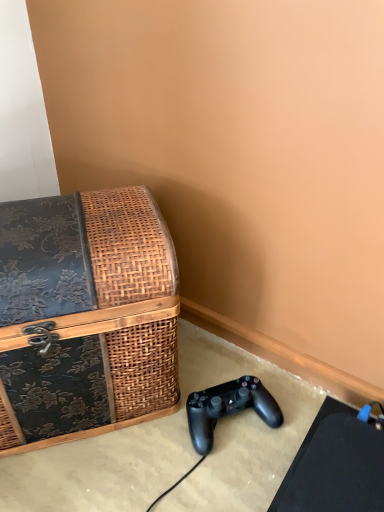
Locate an element on the screen. The width and height of the screenshot is (384, 512). vacant area that lies between black matte game controller at lower right and woven wood trunk at left is located at coordinates point(157,415).